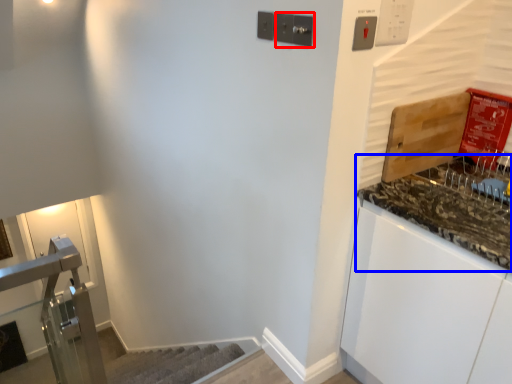
Question: Which of the following is the closest to the observer, light switch (highlighted by a red box) or countertop (highlighted by a blue box)?

Choices:
 (A) light switch
 (B) countertop

Answer: (B)